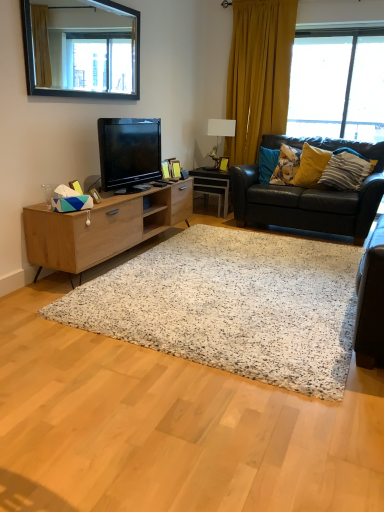
The height and width of the screenshot is (512, 384). What do you see at coordinates (232, 305) in the screenshot?
I see `white speckled rug at center` at bounding box center [232, 305].

Image resolution: width=384 pixels, height=512 pixels. What do you see at coordinates (346, 170) in the screenshot? I see `striped fabric pillow at right, which is counted as the 3th pillow, starting from the left` at bounding box center [346, 170].

Where is `matte black tv at left`? This screenshot has height=512, width=384. matte black tv at left is located at coordinates (129, 151).

What is the approximate height of black framed mirror at upper left?

The height of black framed mirror at upper left is 29.20 inches.

In order to face light wood/finish tv stand at left, should I rotate leftwards or rightwards?

You should look left and rotate roughly 8.565 degrees.

This screenshot has height=512, width=384. What do you see at coordinates (102, 227) in the screenshot?
I see `light wood/finish tv stand at left` at bounding box center [102, 227].

In order to face black leather couch at right, should I rotate leftwards or rightwards?

Turn right by 15.563 degrees to look at black leather couch at right.

The width and height of the screenshot is (384, 512). Find the location of `black leather couch at right`. black leather couch at right is located at coordinates (309, 195).

This screenshot has height=512, width=384. In order to click on white speckled rug at center in this screenshot , I will do `click(232, 305)`.

Which object is more forward, fluffy fabric pillow at upper right, acting as the first pillow starting from the left, or wooden picture frame at center?

Positioned in front is fluffy fabric pillow at upper right, acting as the first pillow starting from the left.

Is fluffy fabric pillow at upper right, the third pillow viewed from the right, wider than wooden picture frame at center?

Indeed, fluffy fabric pillow at upper right, the third pillow viewed from the right, has a greater width compared to wooden picture frame at center.

Is fluffy fabric pillow at upper right, the third pillow viewed from the right, placed right next to wooden picture frame at center?

No, fluffy fabric pillow at upper right, the third pillow viewed from the right, is not next to wooden picture frame at center.

Could you measure the distance between fluffy fabric pillow at upper right, acting as the first pillow starting from the left, and wooden picture frame at center?

fluffy fabric pillow at upper right, acting as the first pillow starting from the left, and wooden picture frame at center are 27.60 inches apart.

Is black leather couch at right shorter than white glossy desk at center?

In fact, black leather couch at right may be taller than white glossy desk at center.

Find the location of a particular element. The height and width of the screenshot is (512, 384). studio couch located in front of the white glossy desk at center is located at coordinates (309, 195).

From the image's perspective, who appears lower, black leather couch at right or white glossy desk at center?

From the image's view, white glossy desk at center is below.

Which is more to the left, black framed mirror at upper left or yellow fabric pillow at right, the second pillow positioned from the left?

Positioned to the left is black framed mirror at upper left.

Is point (59, 23) less distant than point (294, 184)?

Yes, it is in front of point (294, 184).

Is the position of black framed mirror at upper left less distant than that of yellow fabric pillow at right, the second pillow positioned from the left?

Yes, black framed mirror at upper left is closer to the viewer.

Is black framed mirror at upper left placed right next to yellow fabric pillow at right, the second pillow positioned from the left?

They are not placed beside each other.

From a real-world perspective, is wooden picture frame at center below yellow velvet curtain at upper right?

Yes, from a real-world perspective, wooden picture frame at center is below yellow velvet curtain at upper right.

Which of these two, wooden picture frame at center or yellow velvet curtain at upper right, is bigger?

yellow velvet curtain at upper right.

Is wooden picture frame at center next to yellow velvet curtain at upper right and touching it?

There is a gap between wooden picture frame at center and yellow velvet curtain at upper right.

Considering the points (219, 167) and (264, 79), which point is in front, point (219, 167) or point (264, 79)?

The point (219, 167) is in front.

Looking at this image, considering the positions of objects yellow velvet curtain at upper right and wooden picture frame at center in the image provided, who is in front, yellow velvet curtain at upper right or wooden picture frame at center?

yellow velvet curtain at upper right is more forward.

From a real-world perspective, is yellow velvet curtain at upper right on top of wooden picture frame at center?

Correct, in the physical world, yellow velvet curtain at upper right is higher than wooden picture frame at center.

Based on their sizes in the image, would you say yellow velvet curtain at upper right is bigger or smaller than wooden picture frame at center?

yellow velvet curtain at upper right is bigger than wooden picture frame at center.

How much distance is there between yellow velvet curtain at upper right and wooden picture frame at center?

The distance of yellow velvet curtain at upper right from wooden picture frame at center is 3.43 feet.

From the image's perspective, relative to striped fabric pillow at right, acting as the 1th pillow starting from the right, is yellow fabric pillow at right, the second pillow positioned from the left, above or below?

From the image's perspective, yellow fabric pillow at right, the second pillow positioned from the left, appears above striped fabric pillow at right, acting as the 1th pillow starting from the right.

From a real-world perspective, who is located lower, yellow fabric pillow at right, the second pillow positioned from the left, or striped fabric pillow at right, acting as the 1th pillow starting from the right?

striped fabric pillow at right, acting as the 1th pillow starting from the right, is physically lower.

Does point (321, 149) appear closer or farther from the camera than point (344, 157)?

Point (321, 149) appears to be farther away from the viewer than point (344, 157).

Considering the relative sizes of yellow velvet curtain at upper right and fluffy fabric pillow at upper right, acting as the first pillow starting from the left, in the image provided, is yellow velvet curtain at upper right bigger than fluffy fabric pillow at upper right, acting as the first pillow starting from the left,?

Yes, yellow velvet curtain at upper right is bigger than fluffy fabric pillow at upper right, acting as the first pillow starting from the left.

Who is shorter, yellow velvet curtain at upper right or fluffy fabric pillow at upper right, acting as the first pillow starting from the left?

fluffy fabric pillow at upper right, acting as the first pillow starting from the left, is shorter.

From the picture: From the image's perspective, which is below, yellow velvet curtain at upper right or fluffy fabric pillow at upper right, the third pillow viewed from the right?

fluffy fabric pillow at upper right, the third pillow viewed from the right, is shown below in the image.

From the wooden picture frame at center, count 1st pillow to the right and point to it. Please provide its 2D coordinates.

[(286, 165)]

I want to click on studio couch above the white glossy desk at center (from the image's perspective), so click(309, 195).

When comparing their distances from wooden picture frame at center, does striped fabric pillow at right, acting as the 1th pillow starting from the right, or yellow fabric pillow at right, the second pillow positioned from the left, seem further?

Based on the image, striped fabric pillow at right, acting as the 1th pillow starting from the right, appears to be further to wooden picture frame at center.

From the image, which object appears to be nearer to white glossy desk at center, white speckled rug at center or matte black tv at left?

matte black tv at left is positioned closer to the anchor white glossy desk at center.

Based on their spatial positions, is transparent glass window at upper right or white ceramic lamp at upper center closer to fluffy fabric pillow at upper right, the third pillow viewed from the right?

Based on the image, white ceramic lamp at upper center appears to be nearer to fluffy fabric pillow at upper right, the third pillow viewed from the right.

Based on the photo, from the image, which object appears to be farther from transparent glass window at upper right, wooden picture frame at center or white speckled rug at center?

Among the two, white speckled rug at center is located further to transparent glass window at upper right.

Looking at the image, which one is located closer to wooden picture frame at center, white speckled rug at center or transparent glass window at upper right?

transparent glass window at upper right is positioned closer to the anchor wooden picture frame at center.

Estimate the real-world distances between objects in this image. Which object is closer to yellow fabric pillow at right, the 2th pillow positioned from the right, light wood/finish tv stand at left or white ceramic lamp at upper center?

Based on the image, white ceramic lamp at upper center appears to be nearer to yellow fabric pillow at right, the 2th pillow positioned from the right.

Considering their positions, is transparent glass window at upper right positioned closer to wooden picture frame at center than white glossy desk at center?

white glossy desk at center is closer to wooden picture frame at center.

When comparing their distances from striped fabric pillow at right, which is counted as the 3th pillow, starting from the left, does yellow fabric pillow at right, the second pillow positioned from the left, or yellow velvet curtain at upper right seem further?

yellow velvet curtain at upper right is further to striped fabric pillow at right, which is counted as the 3th pillow, starting from the left.

Locate an element on the screen. The width and height of the screenshot is (384, 512). television located between white speckled rug at center and transparent glass window at upper right in the depth direction is located at coordinates (129, 151).

You are a GUI agent. You are given a task and a screenshot of the screen. Output one action in this format:
    pyautogui.click(x=<x>, y=<y>)
    Task: Click on the curtain located between matte black tv at left and transparent glass window at upper right in the left-right direction
    
    Given the screenshot: What is the action you would take?
    pyautogui.click(x=258, y=74)

Where is `curtain located between matte black tv at left and striped fabric pillow at right, acting as the 1th pillow starting from the right, in the left-right direction`? This screenshot has height=512, width=384. curtain located between matte black tv at left and striped fabric pillow at right, acting as the 1th pillow starting from the right, in the left-right direction is located at coordinates (258, 74).

Locate an element on the screen. Image resolution: width=384 pixels, height=512 pixels. pillow between light wood/finish tv stand at left and black leather couch at right from left to right is located at coordinates (286, 165).